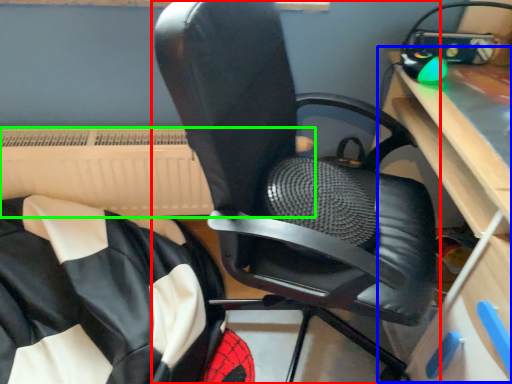
Question: Which object is positioned farthest from chair (highlighted by a red box)? Select from computer desk (highlighted by a blue box) and radiator (highlighted by a green box).

Choices:
 (A) computer desk
 (B) radiator

Answer: (B)